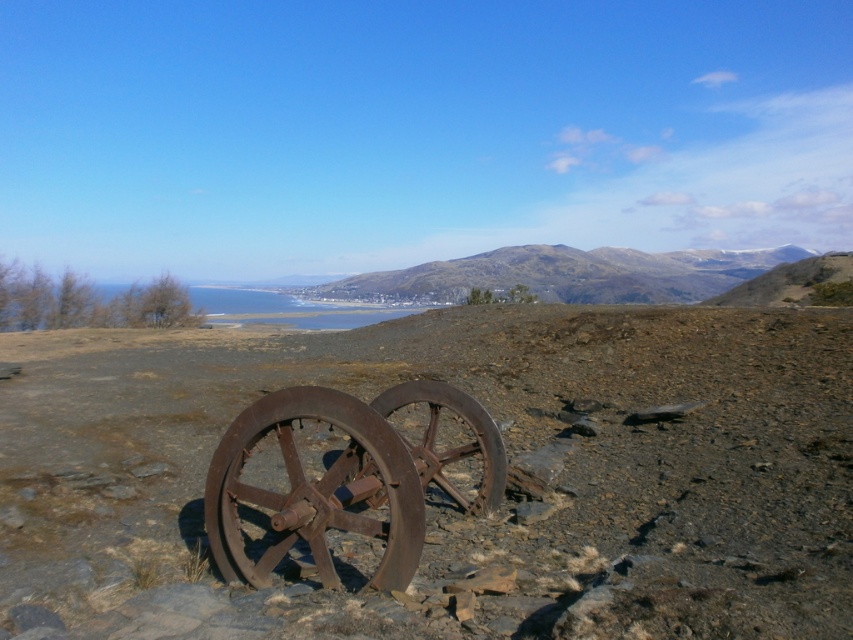
You are hiking and come across the rusty metal wagon wheel at center and the rustic brown hillside at center. Which object is closer to the ground?

The rusty metal wagon wheel at center is closer to the ground because it is positioned below the rustic brown hillside at center.